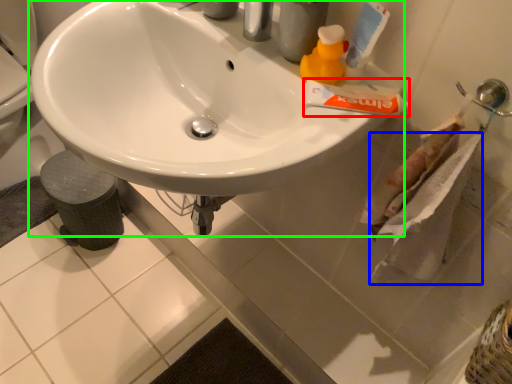
Question: Based on their relative distances, which object is nearer to toothpaste (highlighted by a red box)? Choose from toilet paper (highlighted by a blue box) and sink (highlighted by a green box).

Choices:
 (A) toilet paper
 (B) sink

Answer: (A)